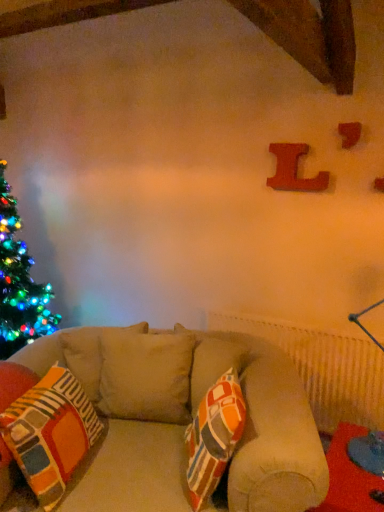
Question: Is point (206, 472) closer or farther from the camera than point (284, 180)?

Choices:
 (A) farther
 (B) closer

Answer: (B)

Question: In terms of height, does multicolored fabric pillow at center look taller or shorter compared to wooden letter l at upper right, the first alphabet viewed from the back?

Choices:
 (A) short
 (B) tall

Answer: (B)

Question: Based on their relative distances, which object is farther from the wooden letter at upper right, the 1th alphabet when ordered from front to back?

Choices:
 (A) wooden letter l at upper right, the first alphabet viewed from the back
 (B) multicolored fabric pillow at center
 (C) multicolored fabric pillow at center
 (D) red fabric table at lower right

Answer: (B)

Question: Estimate the real-world distances between objects in this image. Which object is farther from the red fabric table at lower right?

Choices:
 (A) multicolored fabric pillow at center
 (B) wooden letter at upper right, the 1th alphabet from the right
 (C) wooden letter l at upper right, the first alphabet viewed from the back
 (D) multicolored fabric pillow at center

Answer: (B)